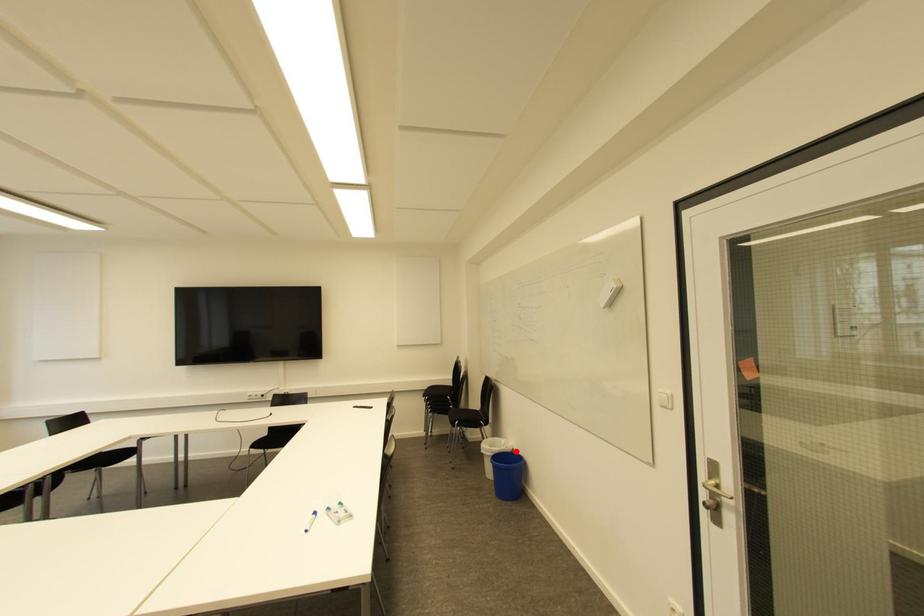
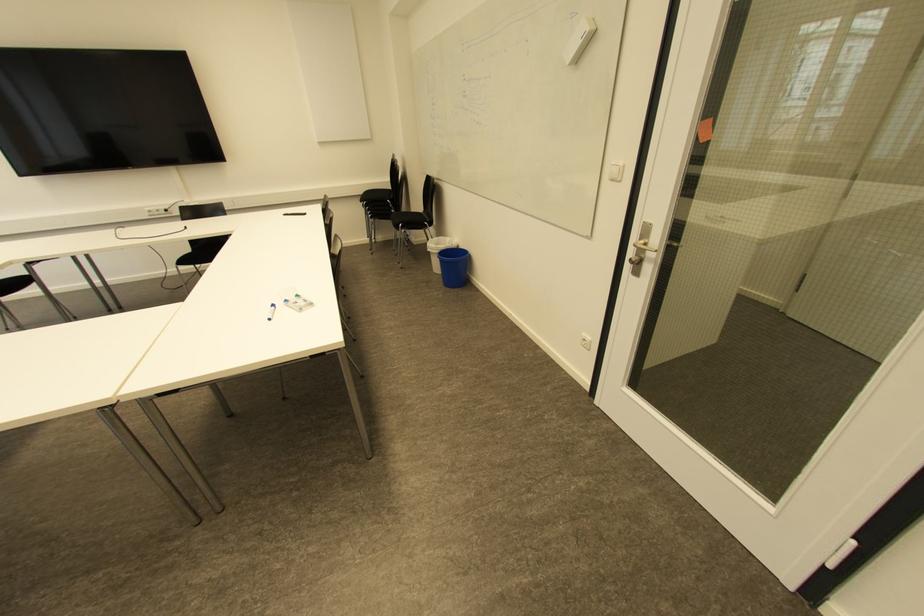
Question: I am providing you with two images of the same scene from different viewpoints. Given a red point in image1, look at the same physical point in image2. Is it:

Choices:
 (A) Closer to the viewpoint
 (B) Farther from the viewpoint

Answer: (A)